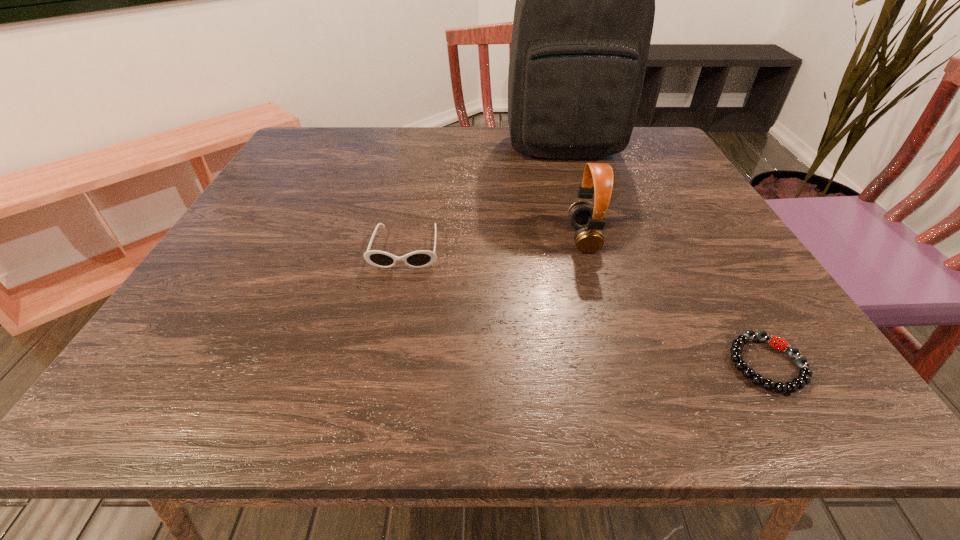
Identify the location of vacant space located on the ear cups of the headset. (472, 239).

This screenshot has width=960, height=540. Find the location of `free space located with the lenses of the second shortest object facing outward`. free space located with the lenses of the second shortest object facing outward is located at coordinates (378, 384).

Identify the location of vacant space located 0.290m on the left of the shortest object. (530, 364).

In order to click on object located in the far edge section of the desktop in this screenshot , I will do `click(585, 0)`.

Locate an element on the screen. The image size is (960, 540). object present at the near edge is located at coordinates (804, 378).

Where is `backpack located in the right edge section of the desktop`? backpack located in the right edge section of the desktop is located at coordinates [585, 0].

Image resolution: width=960 pixels, height=540 pixels. What are the coordinates of `bracelet that is at the right edge` in the screenshot? It's located at (804, 378).

You are a GUI agent. You are given a task and a screenshot of the screen. Output one action in this format:
    pyautogui.click(x=<x>, y=<y>)
    Task: Click on the object that is at the far right corner
    The width and height of the screenshot is (960, 540).
    Given the screenshot: What is the action you would take?
    pyautogui.click(x=585, y=0)

Locate an element on the screen. object present at the near right corner is located at coordinates (804, 378).

Locate an element on the screen. This screenshot has width=960, height=540. free space at the far edge of the desktop is located at coordinates [556, 166].